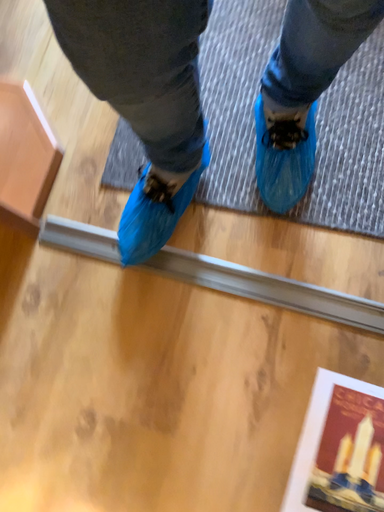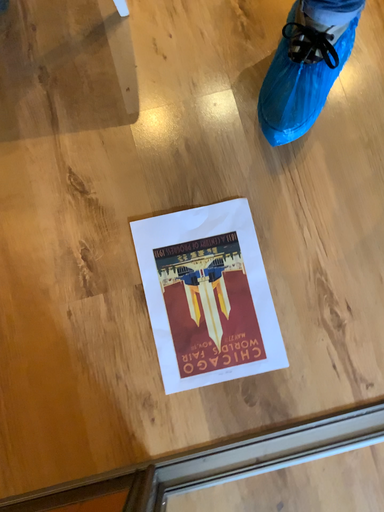
Question: Which way did the camera rotate in the video?

Choices:
 (A) rotated upward
 (B) rotated downward

Answer: (A)